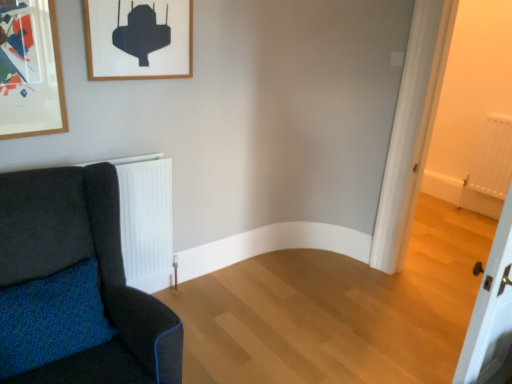
Question: Can you confirm if white matte radiator at right is positioned to the left of wooden picture frame at upper left?

Choices:
 (A) yes
 (B) no

Answer: (B)

Question: Does white matte radiator at right lie in front of wooden picture frame at upper left?

Choices:
 (A) no
 (B) yes

Answer: (A)

Question: Is white matte radiator at right bigger than wooden picture frame at upper left?

Choices:
 (A) no
 (B) yes

Answer: (B)

Question: From the image's perspective, is white matte radiator at right under wooden picture frame at upper left?

Choices:
 (A) no
 (B) yes

Answer: (B)

Question: Is white matte radiator at right with wooden picture frame at upper left?

Choices:
 (A) yes
 (B) no

Answer: (B)

Question: Can you confirm if white matte radiator at right is wider than wooden picture frame at upper left?

Choices:
 (A) yes
 (B) no

Answer: (A)

Question: From the image's perspective, is white matte radiator at right above velvet dark blue sofa at left?

Choices:
 (A) no
 (B) yes

Answer: (B)

Question: Can you confirm if white matte radiator at right is bigger than velvet dark blue sofa at left?

Choices:
 (A) no
 (B) yes

Answer: (A)

Question: Can you confirm if white matte radiator at right is taller than velvet dark blue sofa at left?

Choices:
 (A) yes
 (B) no

Answer: (A)

Question: Is white matte radiator at right next to velvet dark blue sofa at left?

Choices:
 (A) no
 (B) yes

Answer: (A)

Question: Can you confirm if white matte radiator at right is shorter than velvet dark blue sofa at left?

Choices:
 (A) no
 (B) yes

Answer: (A)

Question: From a real-world perspective, is white matte radiator at right over velvet dark blue sofa at left?

Choices:
 (A) yes
 (B) no

Answer: (A)

Question: Is wooden picture frame at upper left completely or partially inside velvet dark blue sofa at left?

Choices:
 (A) yes
 (B) no

Answer: (B)